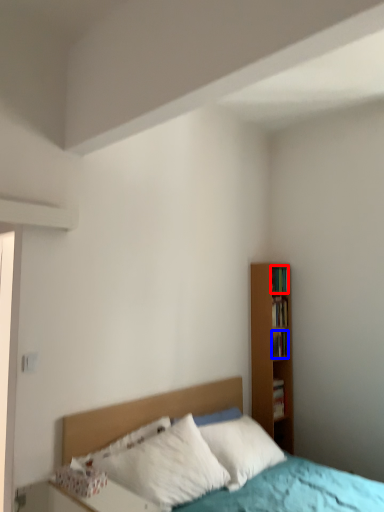
Question: Which object appears closest to the camera in this image, book (highlighted by a red box) or book (highlighted by a blue box)?

Choices:
 (A) book
 (B) book

Answer: (B)